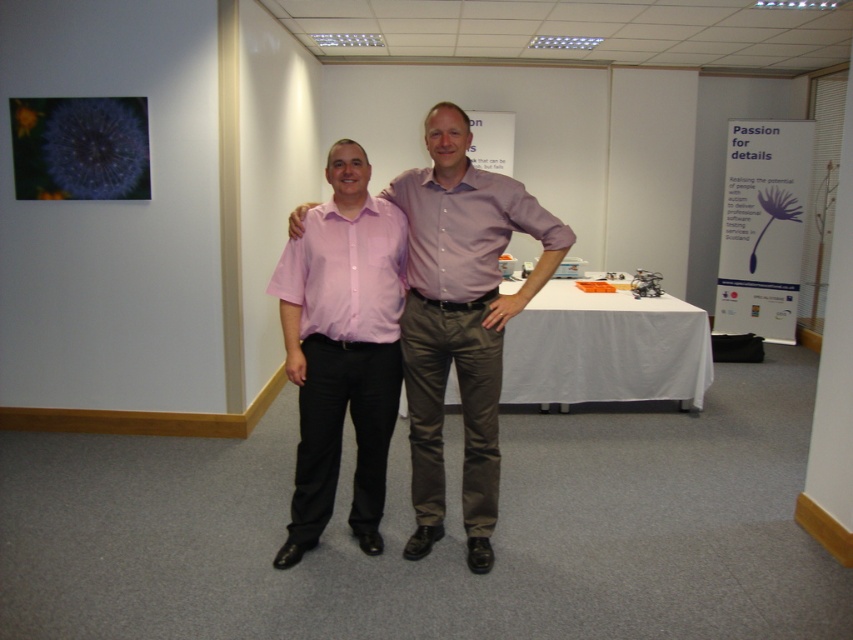
You are standing in front of the table at the professional event. You notice two points marked on the table surface. The first point is at coordinates point (393, 305) and the second point is at point (445, 209). If you were to walk towards the table from your current position, which point would you encounter first?

Point (445, 209) would be encountered first because it is in front of point (393, 305) according to their spatial relationship.

You are standing in the conference room and want to point to the exact location of the point labeled as point (341, 348). According to the scene description, where exactly would this point be located?

The point (341, 348) is located on the pink glossy shirt at center.

You are a photographer at a professional event. You need to capture a closeup shot of both the pink cotton shirt at center and the matte purple shirt at center without any overlap. Given that your camera can focus on a minimum distance of 10 centimeters between subjects, can you achieve this?

The distance between the pink cotton shirt at center and the matte purple shirt at center is 10.90 centimeters. Since the minimum focus distance required is 10 centimeters, the camera can successfully capture both shirts without overlap.